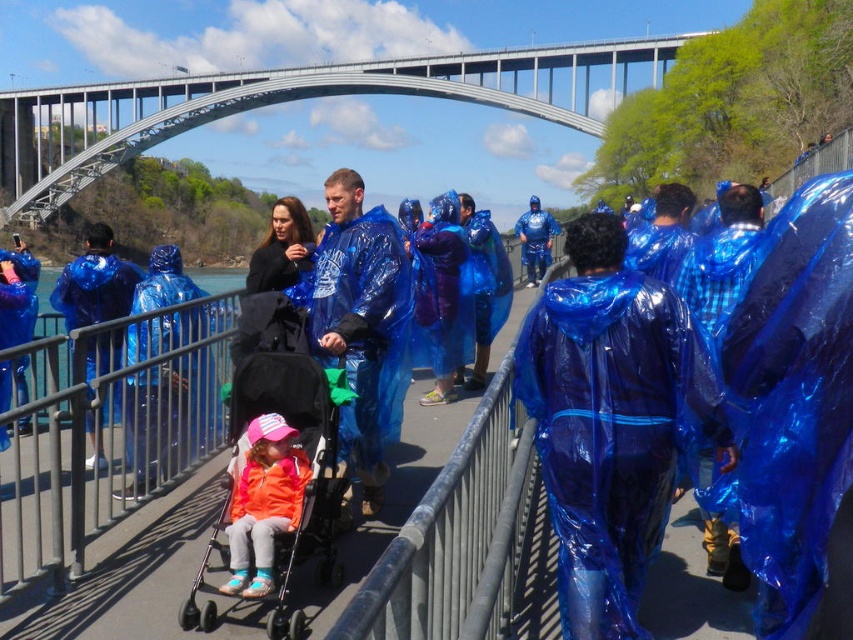
Consider the image. Which is more to the right, metallic gray pedestrian bridge at upper center or orange fabric stroller at center?

From the viewer's perspective, orange fabric stroller at center appears more on the right side.

What do you see at coordinates (297, 99) in the screenshot? I see `metallic gray pedestrian bridge at upper center` at bounding box center [297, 99].

The height and width of the screenshot is (640, 853). What are the coordinates of `metallic gray pedestrian bridge at upper center` in the screenshot? It's located at (297, 99).

Is metallic gray pedestrian bridge at upper center thinner than metallic gray railing at center?

Incorrect, metallic gray pedestrian bridge at upper center's width is not less than metallic gray railing at center's.

Who is lower down, metallic gray pedestrian bridge at upper center or metallic gray railing at center?

metallic gray railing at center is lower down.

The height and width of the screenshot is (640, 853). Find the location of `metallic gray pedestrian bridge at upper center`. metallic gray pedestrian bridge at upper center is located at coordinates coord(297,99).

Locate an element on the screen. Image resolution: width=853 pixels, height=640 pixels. metallic gray pedestrian bridge at upper center is located at coordinates (297, 99).

Is metallic gray pedestrian bridge at upper center shorter than orange fleece jacket at center?

No, metallic gray pedestrian bridge at upper center is not shorter than orange fleece jacket at center.

In the scene shown: Who is more forward, (584,100) or (254,513)?

Point (254,513) is in front.

Between point (132, 92) and point (282, 516), which one is positioned in front?

Point (282, 516) is more forward.

Locate an element on the screen. This screenshot has width=853, height=640. metallic gray pedestrian bridge at upper center is located at coordinates (297, 99).